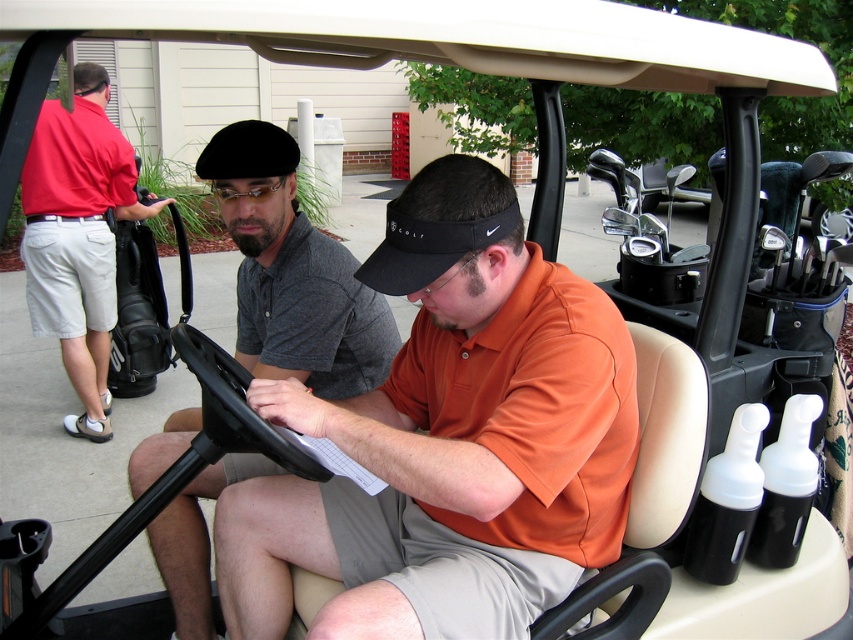
You are a photographer positioned at the back of the golf cart. You want to take a photo of both the dark gray polo shirt at center and the red cotton polo shirt at left. Which one should you focus on first to ensure both are in frame?

The dark gray polo shirt at center is located below the red cotton polo shirt at left, so you should focus on the red cotton polo shirt at left first to ensure both are in frame.

You are a photographer positioned at the edge of the golf course. You want to take a photo of both the orange cotton shirt at center and the dark gray polo shirt at center. The minimum distance between the two subjects for a clear photo is 18 inches. Can you capture both in a single frame without them overlapping?

The orange cotton shirt at center is 20.45 inches away from the dark gray polo shirt at center. Since the required minimum distance for a clear photo is 18 inches, the 20.45 inches distance is sufficient. Yes, you can capture both in a single frame without overlapping.